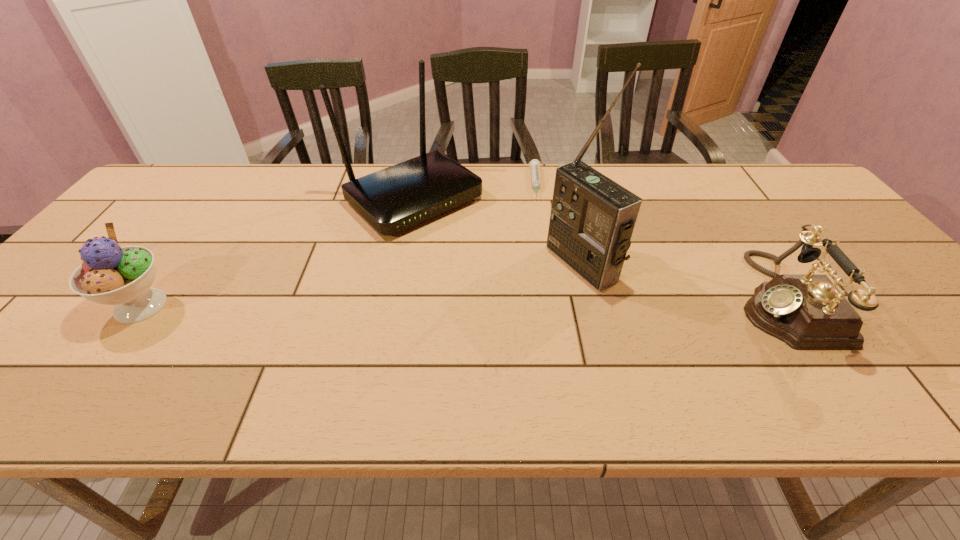
Where is `free space between the telephone and the tallest object`? free space between the telephone and the tallest object is located at coordinates (682, 281).

Image resolution: width=960 pixels, height=540 pixels. Identify the location of free space that is in between the radio receiver and the second object from left to right. [498, 232].

I want to click on the third closest object relative to the radio receiver, so click(x=807, y=312).

Locate which object is the second closest to the shortest object. Please provide its 2D coordinates. Your answer should be formatted as a tuple, i.e. [(x, y)], where the tuple contains the x and y coordinates of a point satisfying the conditions above.

[(592, 219)]

Find the location of `free space that satisfies the following two spatial constraints: 1. on the back side of the icecream; 2. on the right side of the syringe`. free space that satisfies the following two spatial constraints: 1. on the back side of the icecream; 2. on the right side of the syringe is located at coordinates (231, 184).

Locate an element on the screen. vacant region that satisfies the following two spatial constraints: 1. on the front side of the rightmost object; 2. on the dial of the syringe is located at coordinates pos(557,299).

Where is `vacant space that satisfies the following two spatial constraints: 1. on the front side of the rightmost object; 2. on the dial of the syringe`? vacant space that satisfies the following two spatial constraints: 1. on the front side of the rightmost object; 2. on the dial of the syringe is located at coordinates (557, 299).

Find the location of a particular element. This screenshot has width=960, height=540. vacant space that satisfies the following two spatial constraints: 1. on the back side of the fourth shortest object; 2. on the left side of the icecream is located at coordinates pyautogui.click(x=220, y=199).